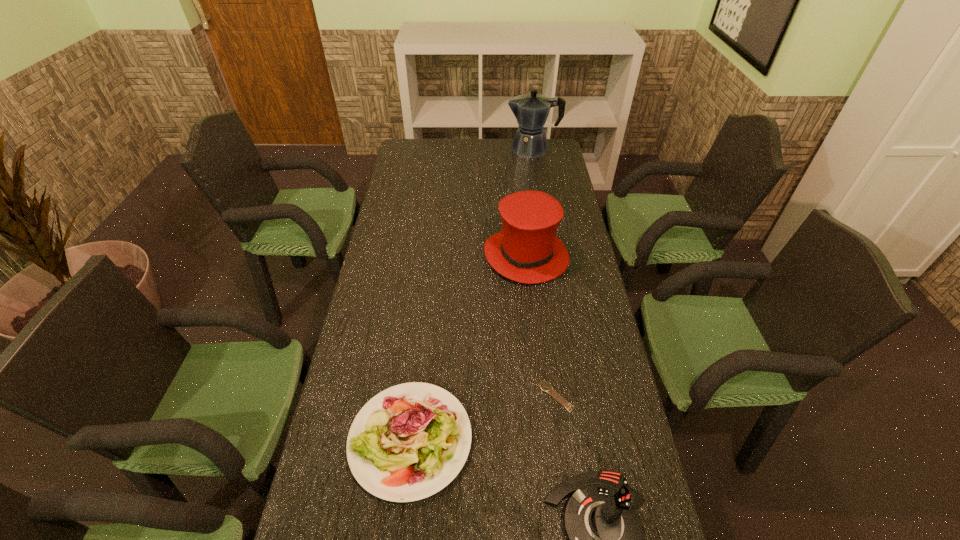
Find the location of a particular element. The image size is (960, 540). coffeepot is located at coordinates [x=531, y=110].

The height and width of the screenshot is (540, 960). What are the coordinates of `the farthest object` in the screenshot? It's located at (531, 110).

Find the location of a particular element. Image resolution: width=960 pixels, height=540 pixels. hat is located at coordinates (527, 250).

Find the location of `the second shortest object`. the second shortest object is located at coordinates (408, 442).

Identify the location of the leftmost object. The image size is (960, 540). (408, 442).

Locate an element on the screen. This screenshot has height=540, width=960. watch is located at coordinates (545, 386).

At what (x,y) coordinates should I click in order to perform the action: click on vacant space located 0.120m at the spout of the tallest object. Please return your answer as a coordinate pair (x, y). Looking at the image, I should click on (480, 148).

The width and height of the screenshot is (960, 540). I want to click on free location located at the spout of the tallest object, so click(473, 148).

Where is `blank space located 0.180m at the spout of the tallest object`? This screenshot has width=960, height=540. blank space located 0.180m at the spout of the tallest object is located at coordinates (468, 148).

Where is `vacant space situated on the left of the hat`? vacant space situated on the left of the hat is located at coordinates (438, 255).